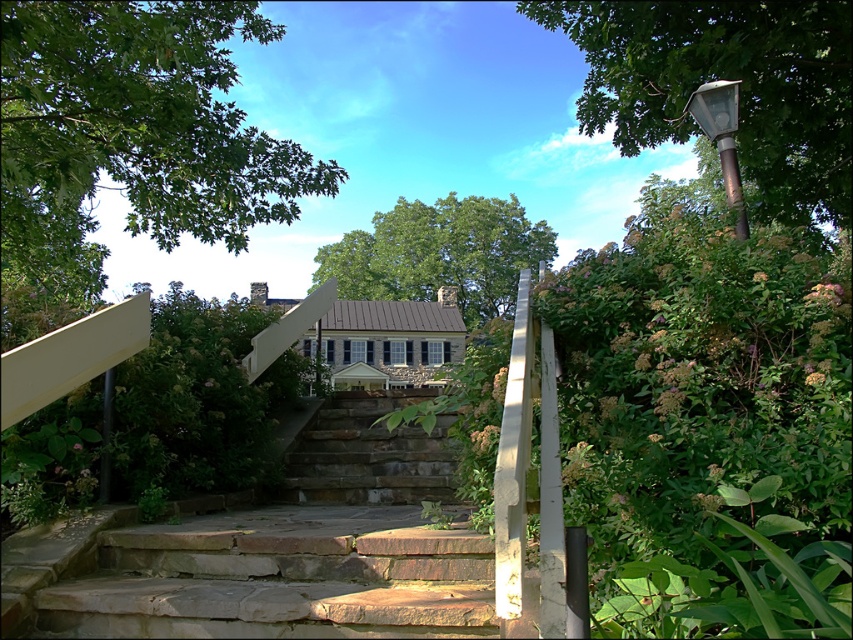
Does point (22, 58) come closer to viewer compared to point (485, 275)?

Yes, point (22, 58) is closer to viewer.

Who is taller, green leafy tree at upper left or green leafy tree at center?

With more height is green leafy tree at upper left.

Is point (341, 177) behind point (349, 269)?

No, it is not.

This screenshot has height=640, width=853. Find the location of `green leafy tree at upper left`. green leafy tree at upper left is located at coordinates (132, 132).

Between green leafy tree at center and natural stone stairs at center, which one appears on the right side from the viewer's perspective?

From the viewer's perspective, green leafy tree at center appears more on the right side.

Can you confirm if green leafy tree at center is taller than natural stone stairs at center?

Yes.

I want to click on green leafy tree at center, so click(x=440, y=253).

Between green leafy tree at upper right and natural stone stairs at center, which one appears on the left side from the viewer's perspective?

natural stone stairs at center

Does point (605, 74) lie behind point (370, 426)?

Yes, point (605, 74) is behind point (370, 426).

Is point (747, 32) positioned after point (434, 467)?

That is True.

The width and height of the screenshot is (853, 640). What are the coordinates of `green leafy tree at upper right` in the screenshot? It's located at (724, 77).